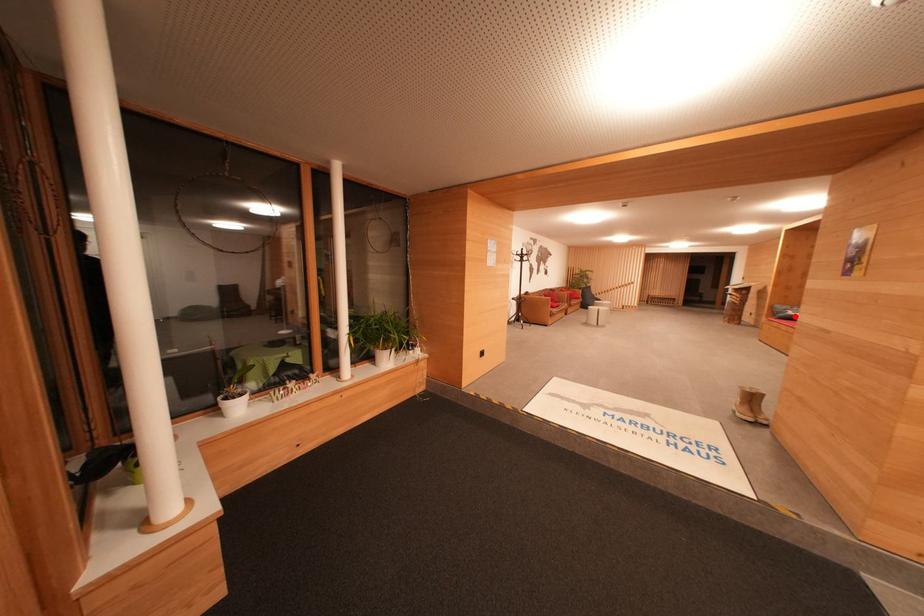
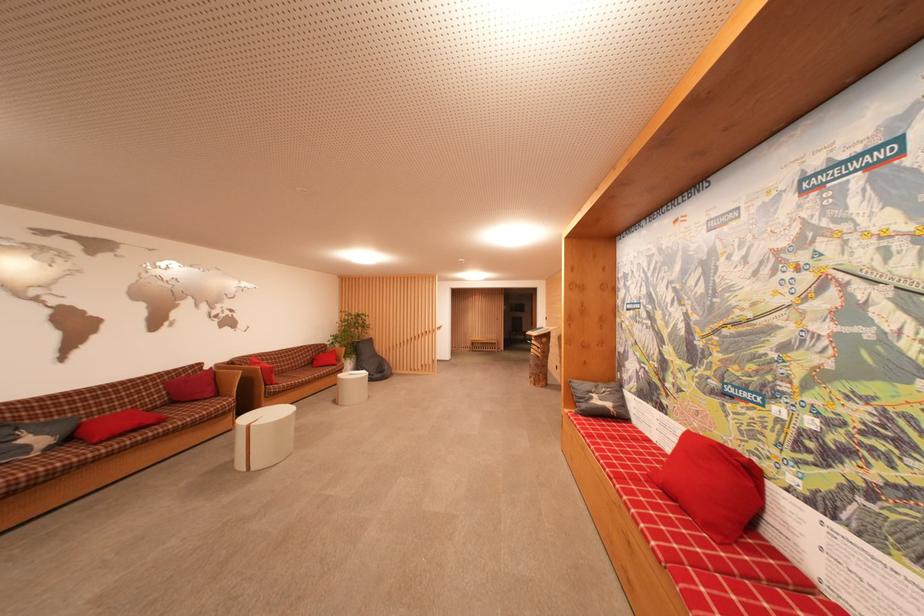
Question: I am providing you with two images of the same scene from different viewpoints. Image1 has a red point marked. In image2, the corresponding 3D location appears at what relative position? Reply with the corresponding letter.

Choices:
 (A) Closer
 (B) Farther

Answer: (A)